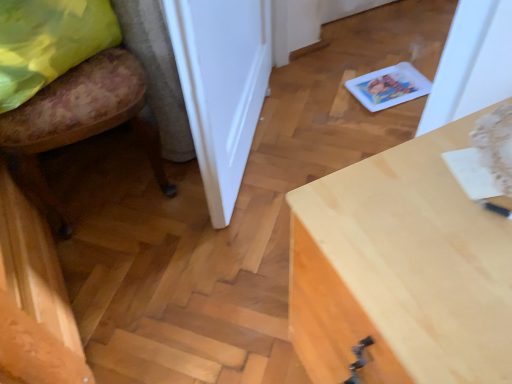
Identify the location of vacant area that is situated to the right of white glossy door at center. Image resolution: width=512 pixels, height=384 pixels. (303, 135).